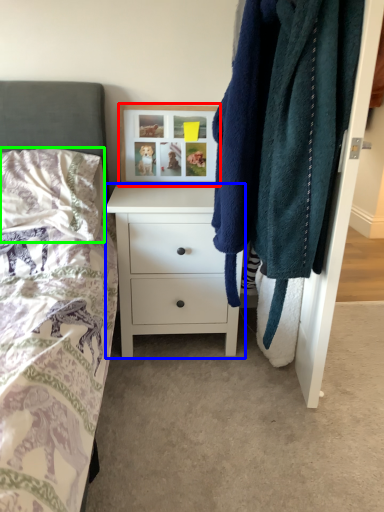
Question: Based on their relative distances, which object is farther from picture frame (highlighted by a red box)? Choose from chest of drawers (highlighted by a blue box) and pillow (highlighted by a green box).

Choices:
 (A) chest of drawers
 (B) pillow

Answer: (B)